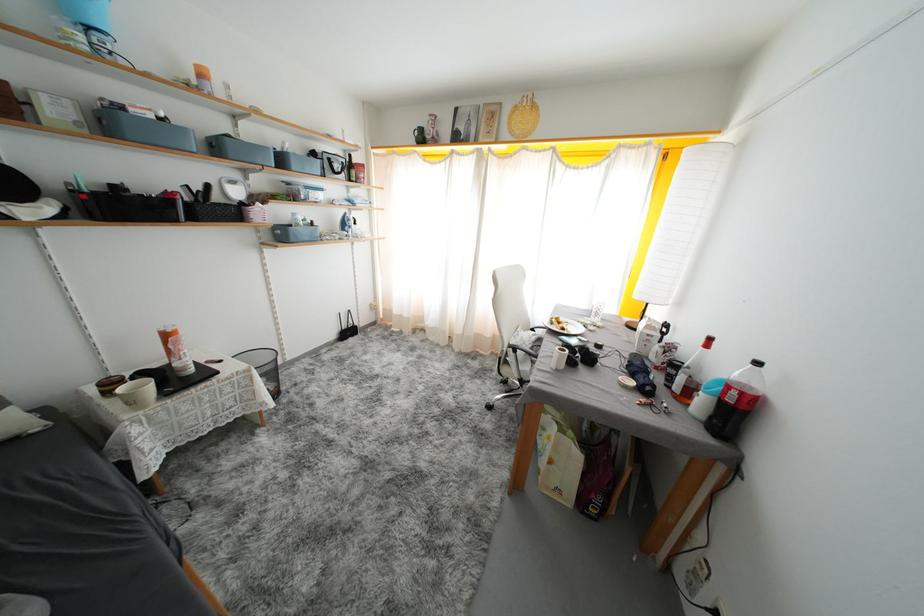
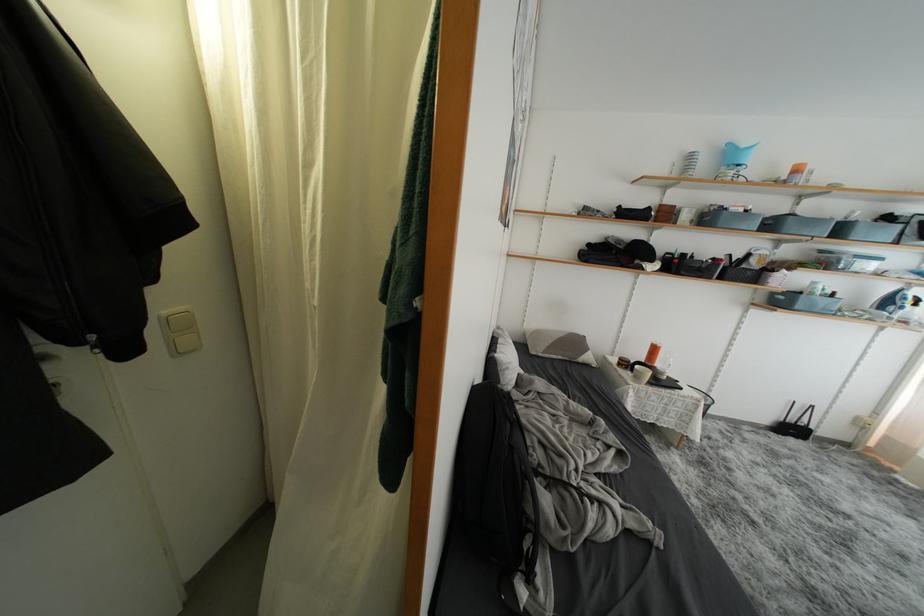
Find the pixel in the second image that matches (294,187) in the first image.

(829, 256)